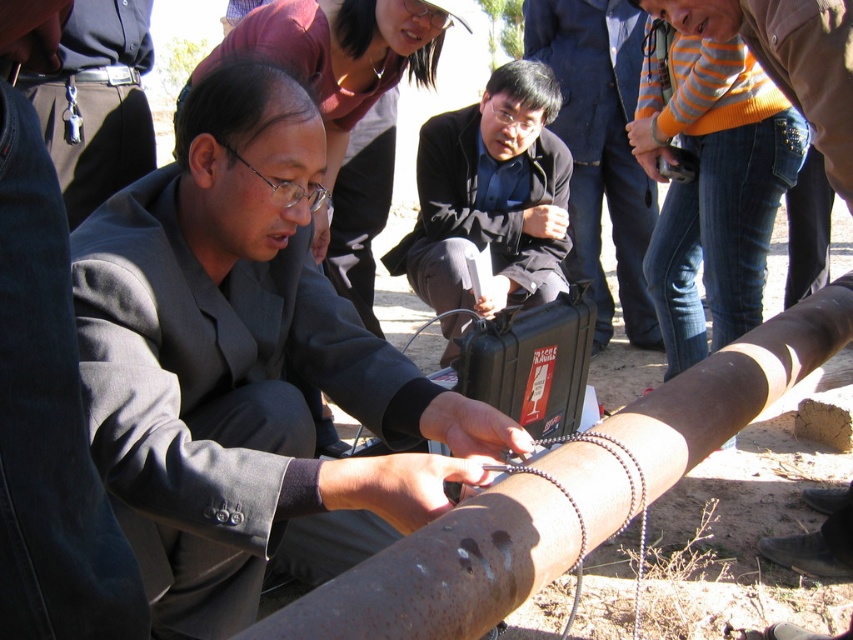
You are a GUI agent. You are given a task and a screenshot of the screen. Output one action in this format:
    pyautogui.click(x=<x>, y=<y>)
    Task: Click on the rusty metal pipe at center
    
    Given the screenshot: What is the action you would take?
    pyautogui.click(x=566, y=496)

Can you confirm if rusty metal pipe at center is shorter than matte black briefcase at center?

Correct, rusty metal pipe at center is not as tall as matte black briefcase at center.

Does point (368, 609) come in front of point (595, 257)?

Yes, point (368, 609) is in front of point (595, 257).

The image size is (853, 640). In order to click on rusty metal pipe at center in this screenshot , I will do `click(566, 496)`.

What do you see at coordinates (242, 362) in the screenshot? I see `matte gray suit at center` at bounding box center [242, 362].

Which is in front, point (318, 372) or point (606, 291)?

Point (318, 372) is more forward.

The width and height of the screenshot is (853, 640). What are the coordinates of `matte gray suit at center` in the screenshot? It's located at (242, 362).

Can you confirm if rusty metal pipe at center is bigger than matte black suit at center?

Correct, rusty metal pipe at center is larger in size than matte black suit at center.

Is point (541, 538) positioned behind point (107, 168)?

No, it is not.

Which is behind, point (664, 426) or point (79, 61)?

The point (79, 61) is behind.

This screenshot has height=640, width=853. Find the location of `rusty metal pipe at center`. rusty metal pipe at center is located at coordinates (566, 496).